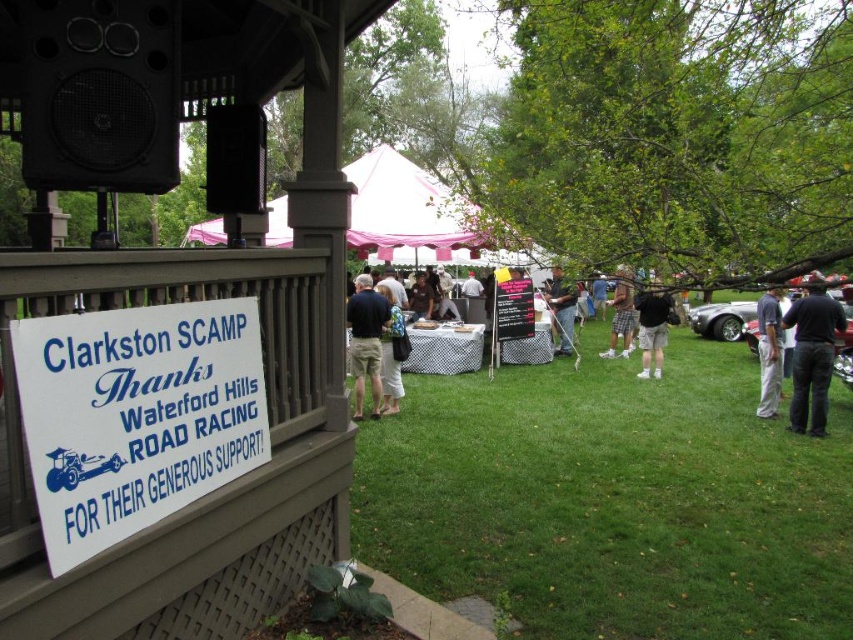
Between pink fabric canopy at upper center and dark blue shirt at center, which one is positioned higher?

Positioned higher is pink fabric canopy at upper center.

How far apart are pink fabric canopy at upper center and dark blue shirt at center?

They are 4.10 meters apart.

You are a GUI agent. You are given a task and a screenshot of the screen. Output one action in this format:
    pyautogui.click(x=<x>, y=<y>)
    Task: Click on the pink fabric canopy at upper center
    The width and height of the screenshot is (853, 640).
    Given the screenshot: What is the action you would take?
    pyautogui.click(x=416, y=216)

Between black cotton shorts at center-right and dark blue jeans at center, which one appears on the right side from the viewer's perspective?

Positioned to the right is black cotton shorts at center-right.

Is point (650, 310) closer to camera compared to point (560, 310)?

Yes.

I want to click on black cotton shorts at center-right, so click(x=653, y=326).

Does green grass at center have a greater height compared to pink fabric canopy at upper center?

No.

The width and height of the screenshot is (853, 640). Describe the element at coordinates (614, 499) in the screenshot. I see `green grass at center` at that location.

Does point (537, 486) come in front of point (398, 204)?

Yes, point (537, 486) is closer to viewer.

Locate an element on the screen. This screenshot has height=640, width=853. green grass at center is located at coordinates coord(614,499).